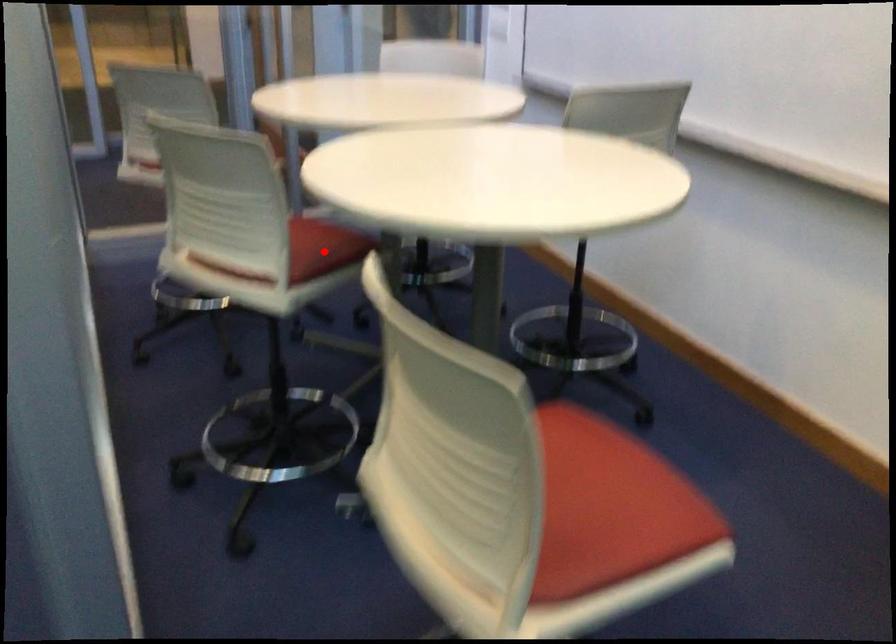
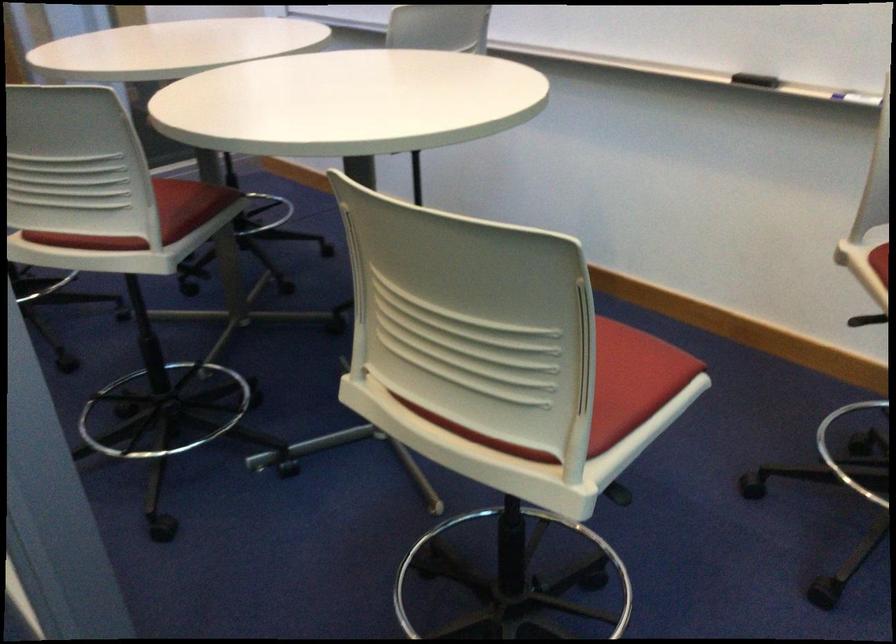
Where in the second image is the point corresponding to the highlighted location from the first image?

(187, 205)